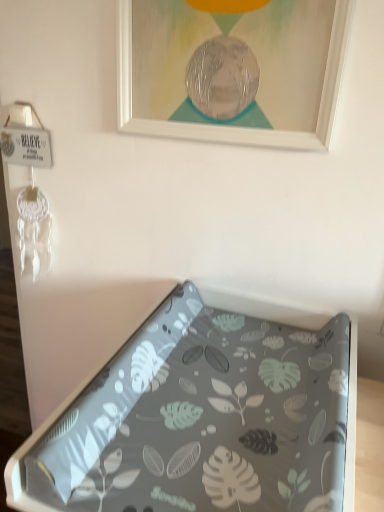
Locate an element on the screen. gray leaf-patterned tray at center is located at coordinates (202, 420).

Measure the distance between point (62, 496) and camera.

The distance of point (62, 496) from camera is 27.17 inches.

The height and width of the screenshot is (512, 384). What do you see at coordinates (202, 420) in the screenshot?
I see `gray leaf-patterned tray at center` at bounding box center [202, 420].

This screenshot has width=384, height=512. What do you see at coordinates (231, 69) in the screenshot?
I see `white matte picture frame at upper center` at bounding box center [231, 69].

Locate an element on the screen. This screenshot has height=512, width=384. white matte picture frame at upper center is located at coordinates (231, 69).

Image resolution: width=384 pixels, height=512 pixels. In order to click on gray leaf-patterned tray at center in this screenshot , I will do `click(202, 420)`.

Does gray leaf-patterned tray at center appear on the right side of white matte picture frame at upper center?

Indeed, gray leaf-patterned tray at center is positioned on the right side of white matte picture frame at upper center.

Which object is closer to the camera, gray leaf-patterned tray at center or white matte picture frame at upper center?

gray leaf-patterned tray at center is in front.

Does point (91, 403) come closer to viewer compared to point (215, 34)?

Yes, it is in front of point (215, 34).

From the image's perspective, is gray leaf-patterned tray at center located above or below white matte picture frame at upper center?

gray leaf-patterned tray at center is situated lower than white matte picture frame at upper center in the image.

From a real-world perspective, is gray leaf-patterned tray at center physically below white matte picture frame at upper center?

Yes, from a real-world perspective, gray leaf-patterned tray at center is beneath white matte picture frame at upper center.

Which object is wider, gray leaf-patterned tray at center or white matte picture frame at upper center?

gray leaf-patterned tray at center.

Which of these two, gray leaf-patterned tray at center or white matte picture frame at upper center, stands taller?

Standing taller between the two is white matte picture frame at upper center.

Is gray leaf-patterned tray at center bigger or smaller than white matte picture frame at upper center?

gray leaf-patterned tray at center is bigger than white matte picture frame at upper center.

Consider the image. Is gray leaf-patterned tray at center not within white matte picture frame at upper center?

Yes, gray leaf-patterned tray at center is not within white matte picture frame at upper center.

Is the surface of gray leaf-patterned tray at center in direct contact with white matte picture frame at upper center?

There is a gap between gray leaf-patterned tray at center and white matte picture frame at upper center.

Is gray leaf-patterned tray at center facing towards white matte picture frame at upper center?

No, gray leaf-patterned tray at center is not oriented towards white matte picture frame at upper center.

What are the coordinates of `picture frame behind the gray leaf-patterned tray at center` in the screenshot? It's located at (231, 69).

Looking at this image, is white matte picture frame at upper center to the right of gray leaf-patterned tray at center from the viewer's perspective?

Incorrect, white matte picture frame at upper center is not on the right side of gray leaf-patterned tray at center.

Which object is further away from the camera, white matte picture frame at upper center or gray leaf-patterned tray at center?

white matte picture frame at upper center is further from the camera.

Between point (198, 131) and point (126, 354), which one is positioned behind?

The point (198, 131) is farther.

From the image's perspective, which is below, white matte picture frame at upper center or gray leaf-patterned tray at center?

From the image's view, gray leaf-patterned tray at center is below.

From a real-world perspective, is white matte picture frame at upper center located beneath gray leaf-patterned tray at center?

No, from a real-world perspective, white matte picture frame at upper center is not beneath gray leaf-patterned tray at center.

Considering the relative sizes of white matte picture frame at upper center and gray leaf-patterned tray at center in the image provided, is white matte picture frame at upper center wider than gray leaf-patterned tray at center?

In fact, white matte picture frame at upper center might be narrower than gray leaf-patterned tray at center.

Can you confirm if white matte picture frame at upper center is taller than gray leaf-patterned tray at center?

Indeed, white matte picture frame at upper center has a greater height compared to gray leaf-patterned tray at center.

Which of these two, white matte picture frame at upper center or gray leaf-patterned tray at center, is bigger?

gray leaf-patterned tray at center.

Consider the image. Is white matte picture frame at upper center inside or outside of gray leaf-patterned tray at center?

white matte picture frame at upper center lies outside gray leaf-patterned tray at center.

Is white matte picture frame at upper center next to gray leaf-patterned tray at center and touching it?

white matte picture frame at upper center and gray leaf-patterned tray at center are clearly separated.

Is white matte picture frame at upper center facing away from gray leaf-patterned tray at center?

No, gray leaf-patterned tray at center is not at the back of white matte picture frame at upper center.

Looking at this image, what's the angular difference between white matte picture frame at upper center and gray leaf-patterned tray at center's facing directions?

There is a 0.672-degree angle between the facing directions of white matte picture frame at upper center and gray leaf-patterned tray at center.

This screenshot has height=512, width=384. In order to click on picture frame that is above the gray leaf-patterned tray at center (from the image's perspective) in this screenshot , I will do `click(231, 69)`.

In order to click on picture frame above the gray leaf-patterned tray at center (from the image's perspective) in this screenshot , I will do `click(231, 69)`.

Identify the location of furniture in front of the white matte picture frame at upper center. The width and height of the screenshot is (384, 512). (202, 420).